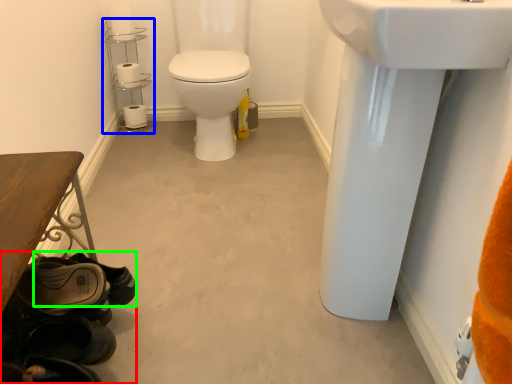
Question: Considering the real-world distances, which object is closest to shoe (highlighted by a red box)? shelf (highlighted by a blue box) or shoe (highlighted by a green box).

Choices:
 (A) shelf
 (B) shoe

Answer: (B)